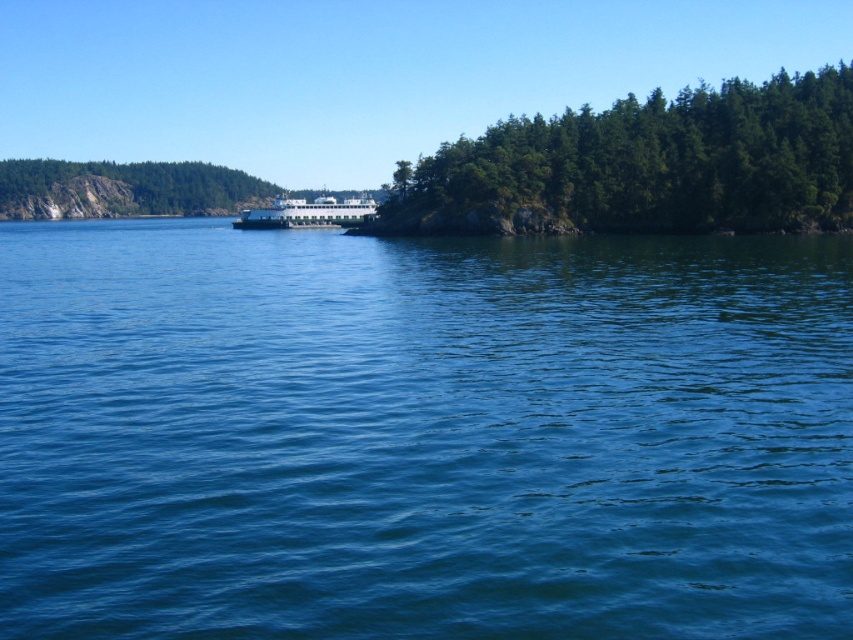
You are a tour guide on a ferry and want to inform passengers about the nearest rock formation. Given the distance between the green matte rock at left and the white glossy ferry at center, can passengers see the rock formation from the ferry deck?

The distance between the green matte rock at left and the white glossy ferry at center is 54.56 meters. Since the ferry deck provides an unobstructed view, passengers can clearly see the green matte rock at left from the ferry deck.

You are standing on the ferry boat docked near the island and want to look at the blue water at center and the green leafy trees at right. Which one would you see first if you turn your head to the left?

The blue water at center is to the left of the green leafy trees at right, so you would see the blue water at center first when turning your head to the left.

You are standing on the ferry boat docked near the island and want to look at the blue water at center and the green matte rock at left. Which object is positioned to the right of the other?

The blue water at center is to the right of the green matte rock at left.